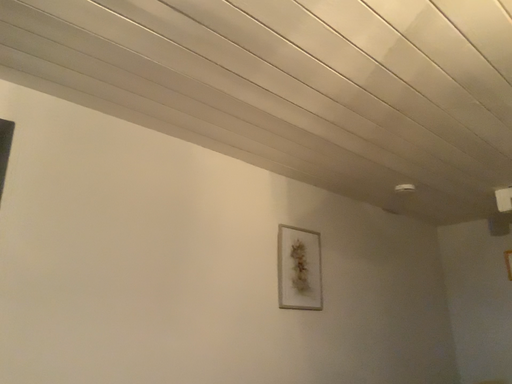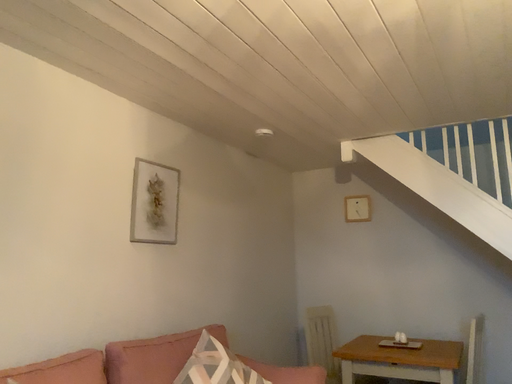
Question: How did the camera likely rotate when shooting the video?

Choices:
 (A) rotated upward
 (B) rotated downward

Answer: (B)